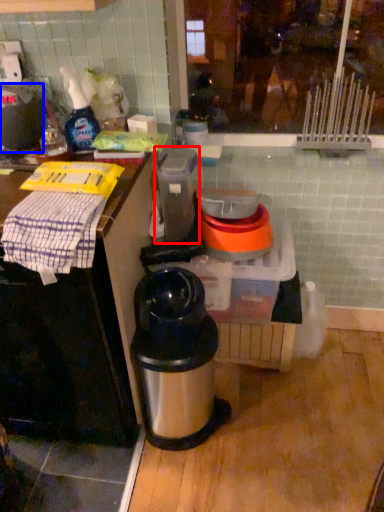
Question: Which point is closer to the camera, appliance (highlighted by a red box) or kitchen appliance (highlighted by a blue box)?

Choices:
 (A) appliance
 (B) kitchen appliance

Answer: (B)